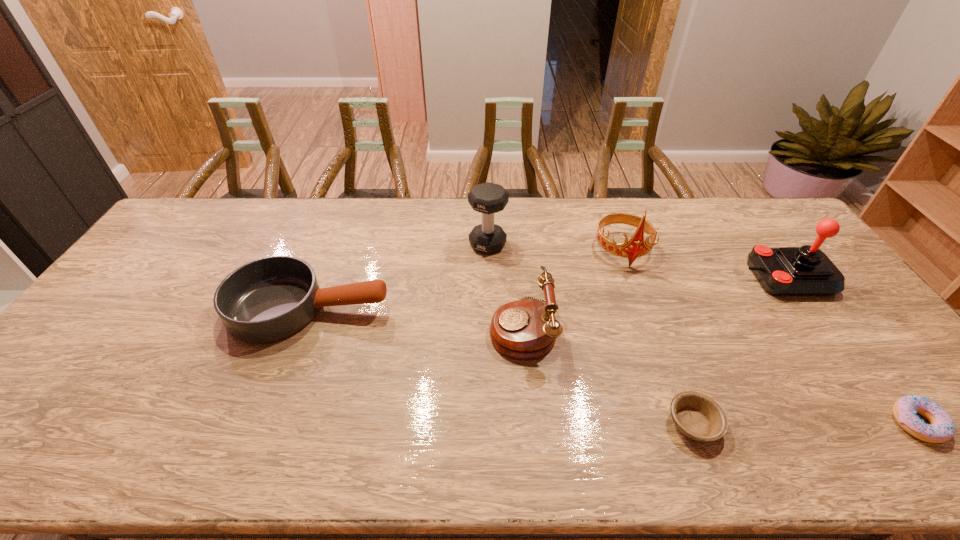
At what (x,y) coordinates should I click in order to perform the action: click on free space between the pan and the bowl. Please return your answer as a coordinate pair (x, y). The height and width of the screenshot is (540, 960). Looking at the image, I should click on (501, 366).

The height and width of the screenshot is (540, 960). Identify the location of empty space that is in between the bowl and the joystick. (739, 350).

Find the location of a particular element. Image resolution: width=960 pixels, height=540 pixels. blank region between the telephone and the tiara is located at coordinates (572, 288).

Find the location of a particular element. empty location between the joystick and the dumbbell is located at coordinates click(x=636, y=261).

You are a GUI agent. You are given a task and a screenshot of the screen. Output one action in this format:
    pyautogui.click(x=<x>, y=<y>)
    Task: Click on the free spot between the joystick and the shortest object
    Image resolution: width=960 pixels, height=540 pixels.
    Given the screenshot: What is the action you would take?
    pyautogui.click(x=739, y=350)

Where is `free space between the dumbbell and the tiara`? The height and width of the screenshot is (540, 960). free space between the dumbbell and the tiara is located at coordinates (555, 247).

The height and width of the screenshot is (540, 960). What are the coordinates of `free space between the telephone and the joystick` in the screenshot? It's located at (654, 302).

Where is `blank region between the joystick and the bowl`? The width and height of the screenshot is (960, 540). blank region between the joystick and the bowl is located at coordinates (739, 350).

Image resolution: width=960 pixels, height=540 pixels. I want to click on vacant point located between the shortest object and the dumbbell, so click(590, 334).

Find the location of a particular element. This screenshot has width=960, height=540. vacant point located between the tiara and the doughnut is located at coordinates (770, 336).